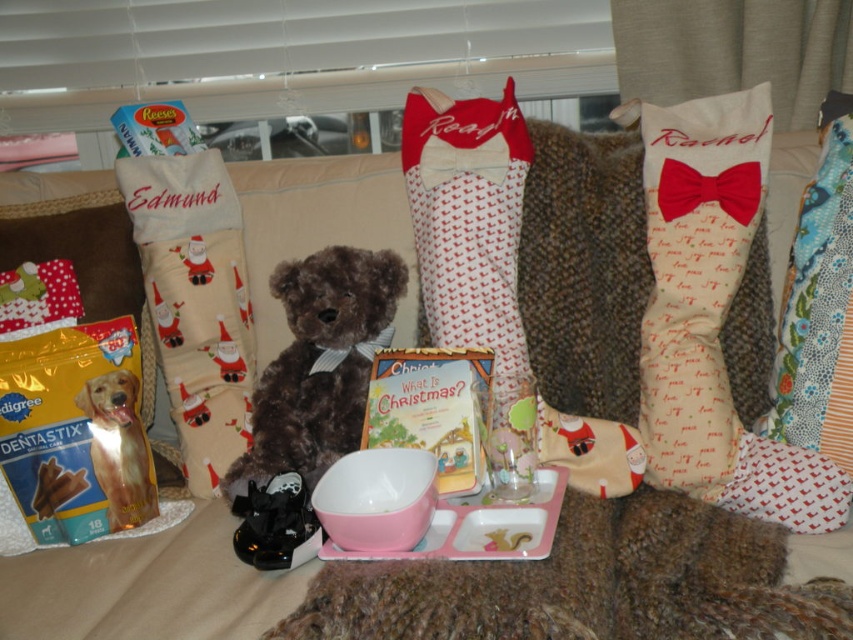
Measure the distance from floral fabric cushion at right to black rubber shoes at lower center.

A distance of 27.57 inches exists between floral fabric cushion at right and black rubber shoes at lower center.

Who is positioned more to the left, floral fabric cushion at right or black rubber shoes at lower center?

From the viewer's perspective, black rubber shoes at lower center appears more on the left side.

Who is more forward, (844, 257) or (283, 476)?

Point (283, 476) is more forward.

Where is `floral fabric cushion at right`? floral fabric cushion at right is located at coordinates (819, 305).

Who is higher up, brown plush teddy bear at center or floral fabric cushion at right?

floral fabric cushion at right

Is point (354, 301) positioned in front of point (822, 164)?

No, it is not.

At what (x,y) coordinates should I click in order to perform the action: click on brown plush teddy bear at center. Please return your answer as a coordinate pair (x, y). Looking at the image, I should click on (318, 364).

Who is higher up, brown plush teddy bear at center or pink plastic tray at center?

brown plush teddy bear at center is above.

Who is lower down, brown plush teddy bear at center or pink plastic tray at center?

Positioned lower is pink plastic tray at center.

Between point (299, 365) and point (543, 550), which one is positioned behind?

Point (299, 365)

Identify the location of brown plush teddy bear at center. (318, 364).